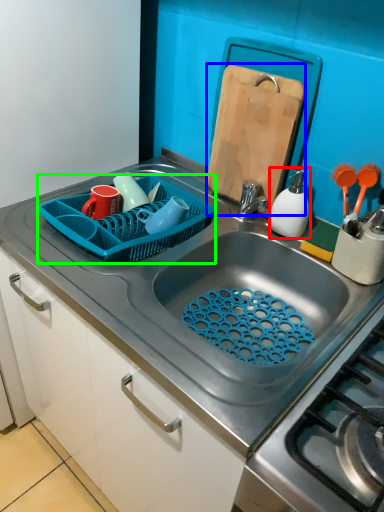
Question: Based on their relative distances, which object is nearer to appliance (highlighted by a red box)? Choose from cutting board (highlighted by a blue box) and basket (highlighted by a green box).

Choices:
 (A) cutting board
 (B) basket

Answer: (A)